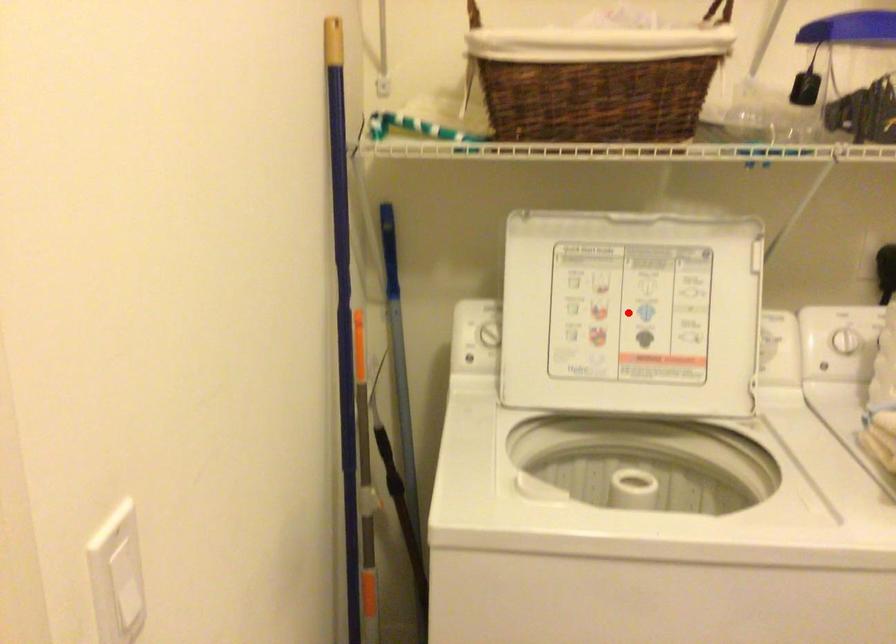
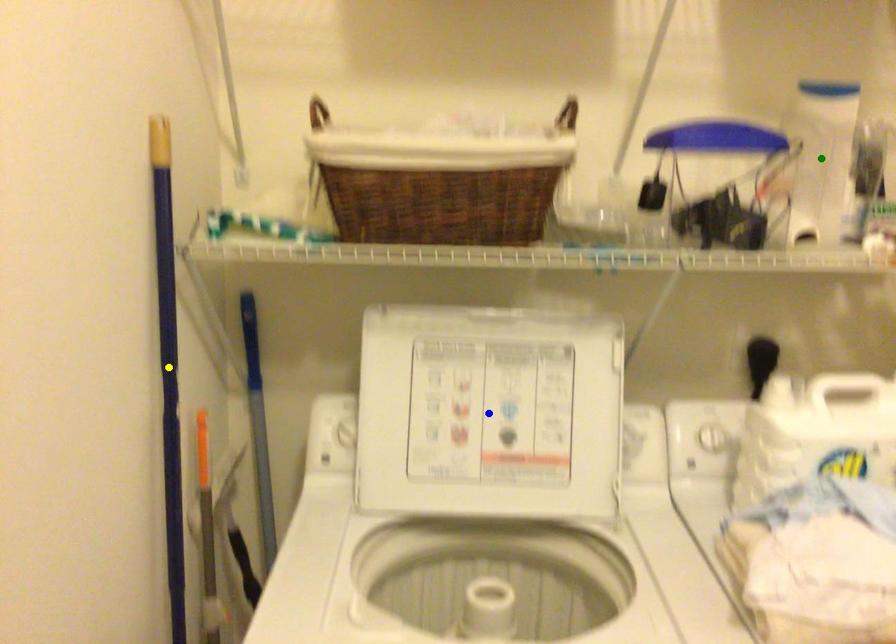
Question: I am providing you with two images of the same scene from different viewpoints. A red point is marked on the first image. You are given multiple points on the second image. Which spot in image 2 lines up with the point in image 1?

Choices:
 (A) blue point
 (B) yellow point
 (C) green point

Answer: (A)